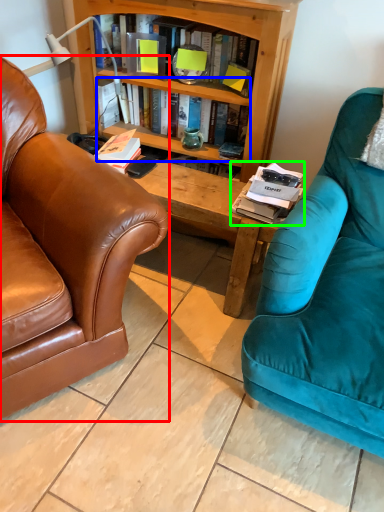
Question: Considering the real-world distances, which object is farthest from chair (highlighted by a red box)? book (highlighted by a blue box) or magazine (highlighted by a green box)?

Choices:
 (A) book
 (B) magazine

Answer: (A)